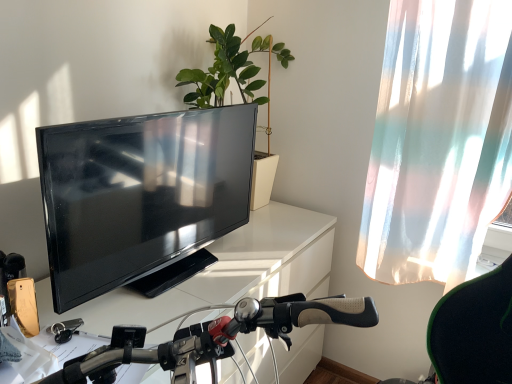
Measure the distance between point (162, 177) and camera.

Point (162, 177) and camera are 3.83 feet apart.

Image resolution: width=512 pixels, height=384 pixels. Find the location of `matte black tv at left`. matte black tv at left is located at coordinates (140, 194).

Locate an element on the screen. This screenshot has height=384, width=512. green matte plant at upper center is located at coordinates (239, 90).

You are a GUI agent. You are given a task and a screenshot of the screen. Output one action in this format:
    pyautogui.click(x=<x>, y=<y>)
    Task: Click on the white glossy desk at center
    This screenshot has width=512, height=384.
    Given the screenshot: What is the action you would take?
    pyautogui.click(x=225, y=272)

What are the coordinates of `matte black tv at left` in the screenshot? It's located at (140, 194).

Which object is positioned more to the right, white glossy desk at center or green matte plant at upper center?

green matte plant at upper center.

This screenshot has width=512, height=384. I want to click on desk on the left of the green matte plant at upper center, so click(225, 272).

From the image's perspective, who appears lower, white glossy desk at center or green matte plant at upper center?

From the image's view, white glossy desk at center is below.

Is white glossy desk at center oriented towards green matte plant at upper center?

No, white glossy desk at center is not facing towards green matte plant at upper center.

From the image's perspective, relative to white glossy desk at center, is translucent fabric curtain at right above or below?

translucent fabric curtain at right is situated higher than white glossy desk at center in the image.

Between translucent fabric curtain at right and white glossy desk at center, which one appears on the right side from the viewer's perspective?

Positioned to the right is translucent fabric curtain at right.

Image resolution: width=512 pixels, height=384 pixels. In order to click on curtain lying on the right of white glossy desk at center in this screenshot , I will do `click(438, 141)`.

Is matte black tv at left to the right of green matte plant at upper center from the viewer's perspective?

No.

Can you confirm if matte black tv at left is taller than green matte plant at upper center?

Incorrect, the height of matte black tv at left is not larger of that of green matte plant at upper center.

Are matte black tv at left and green matte plant at upper center beside each other?

There is a gap between matte black tv at left and green matte plant at upper center.

Considering the sizes of objects matte black tv at left and green matte plant at upper center in the image provided, who is wider, matte black tv at left or green matte plant at upper center?

With larger width is green matte plant at upper center.

From the image's perspective, who appears lower, matte black tv at left or translucent fabric curtain at right?

matte black tv at left is shown below in the image.

Which of these two, matte black tv at left or translucent fabric curtain at right, is thinner?

With smaller width is matte black tv at left.

Is matte black tv at left facing towards translucent fabric curtain at right?

Yes, matte black tv at left is oriented towards translucent fabric curtain at right.

From a real-world perspective, is translucent fabric curtain at right physically above matte black tv at left?

Yes, from a real-world perspective, translucent fabric curtain at right is above matte black tv at left.

This screenshot has height=384, width=512. I want to click on television below the translucent fabric curtain at right (from a real-world perspective), so click(x=140, y=194).

Is translucent fabric curtain at right wider or thinner than matte black tv at left?

Considering their sizes, translucent fabric curtain at right looks broader than matte black tv at left.

Which is behind, green matte plant at upper center or translucent fabric curtain at right?

green matte plant at upper center is further away from the camera.

Locate an element on the screen. houseplant directly beneath the translucent fabric curtain at right (from a real-world perspective) is located at coordinates [x=239, y=90].

Considering the sizes of objects green matte plant at upper center and translucent fabric curtain at right in the image provided, who is taller, green matte plant at upper center or translucent fabric curtain at right?

With more height is translucent fabric curtain at right.

Is the surface of green matte plant at upper center in direct contact with translucent fabric curtain at right?

No, green matte plant at upper center is not in contact with translucent fabric curtain at right.

Which object is wider, green matte plant at upper center or matte black tv at left?

With larger width is green matte plant at upper center.

Locate an element on the screen. This screenshot has height=384, width=512. television below the green matte plant at upper center (from a real-world perspective) is located at coordinates (140, 194).

From a real-world perspective, is green matte plant at upper center physically located above or below matte black tv at left?

green matte plant at upper center is situated higher than matte black tv at left in the real world.

At what (x,y) coordinates should I click in order to perform the action: click on desk that is in front of the green matte plant at upper center. Please return your answer as a coordinate pair (x, y). Looking at the image, I should click on (225, 272).

Locate an element on the screen. This screenshot has width=512, height=384. curtain above the white glossy desk at center (from a real-world perspective) is located at coordinates (438, 141).

Based on their spatial positions, is green matte plant at upper center or translucent fabric curtain at right further from white glossy desk at center?

The object further to white glossy desk at center is translucent fabric curtain at right.

When comparing their distances from matte black tv at left, does white glossy desk at center or green matte plant at upper center seem further?

green matte plant at upper center.

Considering their positions, is white glossy desk at center positioned closer to matte black tv at left than translucent fabric curtain at right?

white glossy desk at center.

From the image, which object appears to be nearer to matte black tv at left, translucent fabric curtain at right or green matte plant at upper center?

green matte plant at upper center is closer to matte black tv at left.

Looking at the image, which one is located closer to translucent fabric curtain at right, white glossy desk at center or matte black tv at left?

white glossy desk at center is closer to translucent fabric curtain at right.

From the image, which object appears to be farther from translucent fabric curtain at right, white glossy desk at center or green matte plant at upper center?

Based on the image, green matte plant at upper center appears to be further to translucent fabric curtain at right.

Estimate the real-world distances between objects in this image. Which object is further from green matte plant at upper center, matte black tv at left or translucent fabric curtain at right?

translucent fabric curtain at right is further to green matte plant at upper center.

Looking at the image, which one is located closer to white glossy desk at center, matte black tv at left or translucent fabric curtain at right?

Among the two, matte black tv at left is located nearer to white glossy desk at center.

Find the location of `houseplant located between matte black tv at left and translucent fabric curtain at right in the left-right direction`. houseplant located between matte black tv at left and translucent fabric curtain at right in the left-right direction is located at coordinates (239, 90).

This screenshot has width=512, height=384. Identify the location of desk situated between matte black tv at left and translucent fabric curtain at right from left to right. (225, 272).

Locate an element on the screen. Image resolution: width=512 pixels, height=384 pixels. television between green matte plant at upper center and white glossy desk at center vertically is located at coordinates (140, 194).

Find the location of `curtain that lies between green matte plant at upper center and white glossy desk at center from top to bottom`. curtain that lies between green matte plant at upper center and white glossy desk at center from top to bottom is located at coordinates (438, 141).